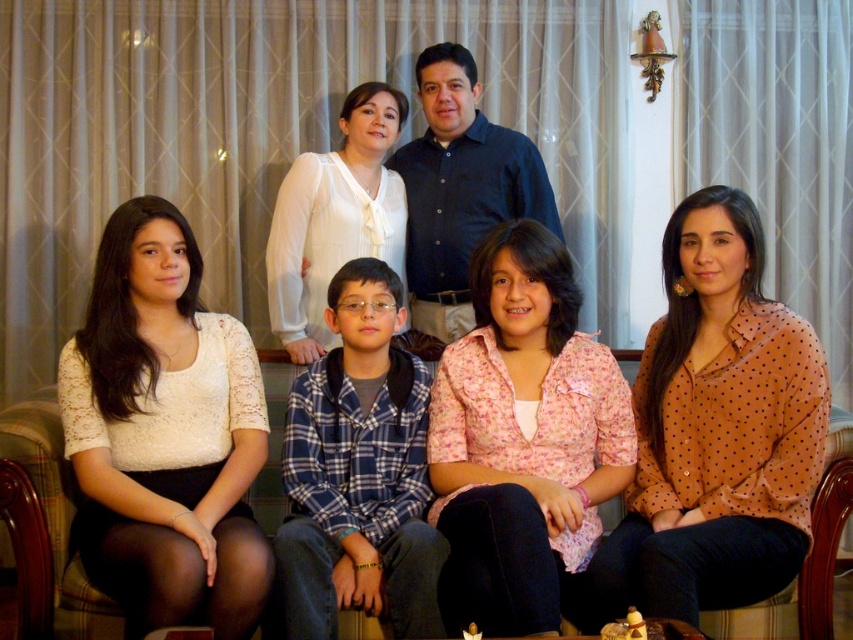
Is brown dotted blouse at lower right further to the viewer compared to pink floral blouse at center?

Yes, it is.

Between brown dotted blouse at lower right and pink floral blouse at center, which one appears on the left side from the viewer's perspective?

pink floral blouse at center is more to the left.

Which is behind, point (689, 524) or point (543, 362)?

Point (543, 362)

Where is `brown dotted blouse at lower right`? brown dotted blouse at lower right is located at coordinates (715, 429).

Which is below, white lace blouse at lower left or brown dotted blouse at lower right?

white lace blouse at lower left

Identify the location of white lace blouse at lower left. Image resolution: width=853 pixels, height=640 pixels. (164, 435).

Find the location of a particular element. The height and width of the screenshot is (640, 853). white lace blouse at lower left is located at coordinates (164, 435).

Does white lace blouse at lower left have a lesser width compared to pink floral blouse at center?

No.

Does white lace blouse at lower left lie in front of pink floral blouse at center?

No.

Where is `white lace blouse at lower left`? The width and height of the screenshot is (853, 640). white lace blouse at lower left is located at coordinates (164, 435).

Find the location of a particular element. The image size is (853, 640). white lace blouse at lower left is located at coordinates (164, 435).